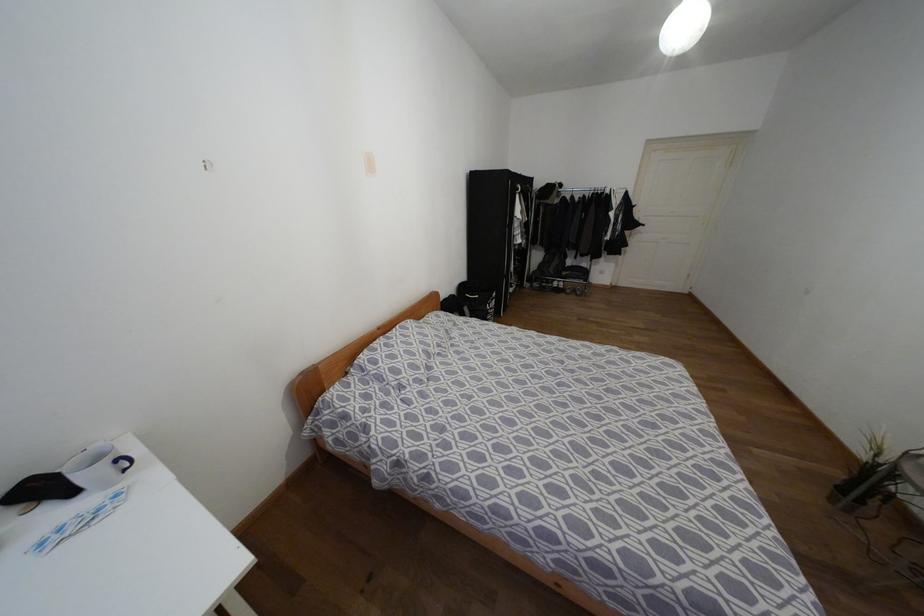
The location [478,298] corresponds to which object?

This point indicates the black laundry hamper.